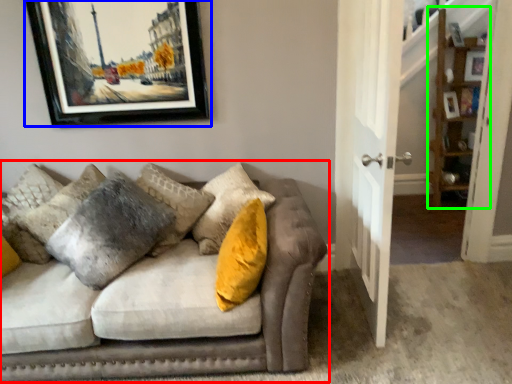
Question: Estimate the real-world distances between objects in this image. Which object is farther from studio couch (highlighted by a red box), picture frame (highlighted by a blue box) or shelf (highlighted by a green box)?

Choices:
 (A) picture frame
 (B) shelf

Answer: (B)